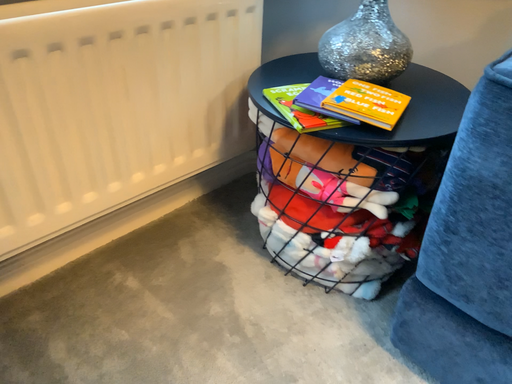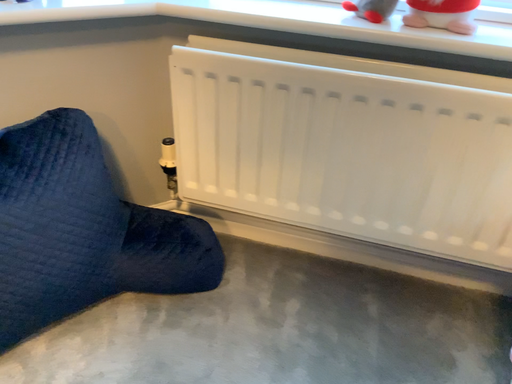
Question: Which way did the camera rotate in the video?

Choices:
 (A) rotated upward
 (B) rotated downward

Answer: (A)